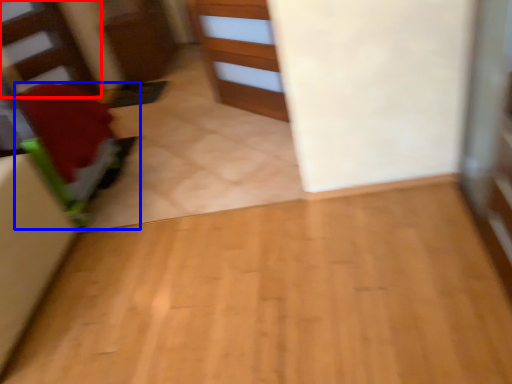
Question: Which object is further to the camera taking this photo, stairwell (highlighted by a red box) or furniture (highlighted by a blue box)?

Choices:
 (A) stairwell
 (B) furniture

Answer: (A)